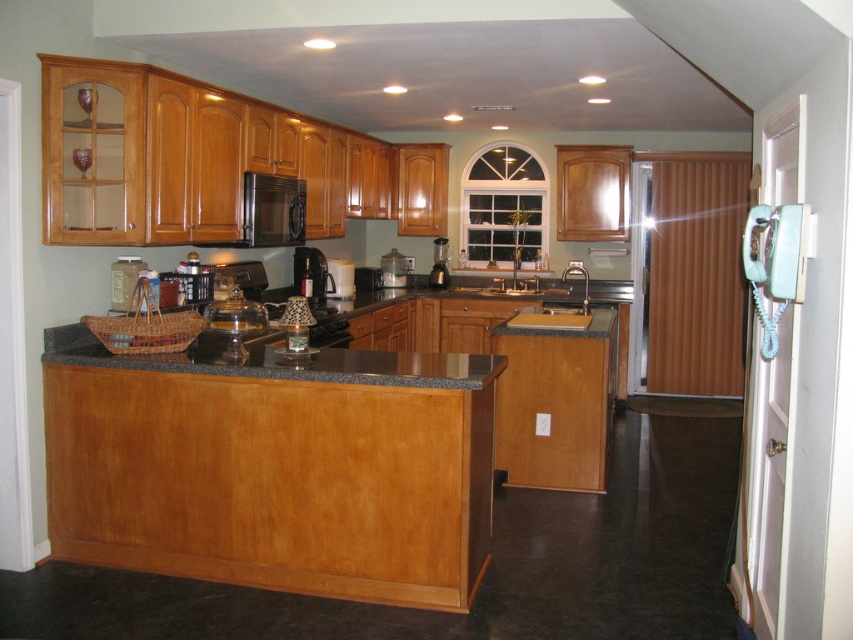
Question: Which object is farther from the camera taking this photo?

Choices:
 (A) black plastic coffee machine at center
 (B) clear glass blender at center
 (C) white plastic blender at center
 (D) metallic silver coffee maker at center

Answer: (B)

Question: Which is nearer to the metallic stainless steel sink at center?

Choices:
 (A) satin black microwave at upper center
 (B) black plastic blender at center
 (C) black plastic coffee machine at center

Answer: (C)

Question: Is black plastic coffee machine at center positioned in front of white plastic blender at center?

Choices:
 (A) yes
 (B) no

Answer: (A)

Question: Which object appears farthest from the camera in this image?

Choices:
 (A) metallic silver coffee maker at center
 (B) satin black microwave at upper center
 (C) metallic stainless steel sink at center
 (D) clear glass blender at center

Answer: (D)

Question: Does black plastic coffee machine at center appear under clear glass blender at center?

Choices:
 (A) no
 (B) yes

Answer: (B)

Question: Does black plastic coffee machine at center appear under clear glass blender at center?

Choices:
 (A) yes
 (B) no

Answer: (A)